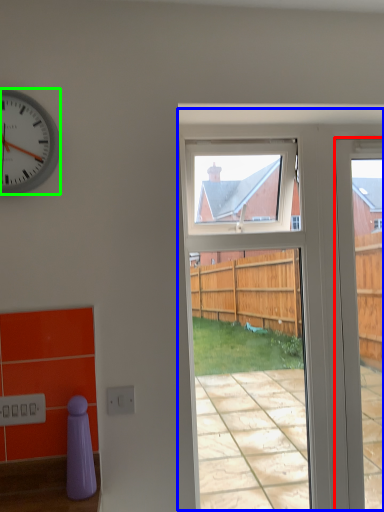
Question: Considering the real-world distances, which object is farthest from door (highlighted by a red box)? screen door (highlighted by a blue box) or clock (highlighted by a green box)?

Choices:
 (A) screen door
 (B) clock

Answer: (B)